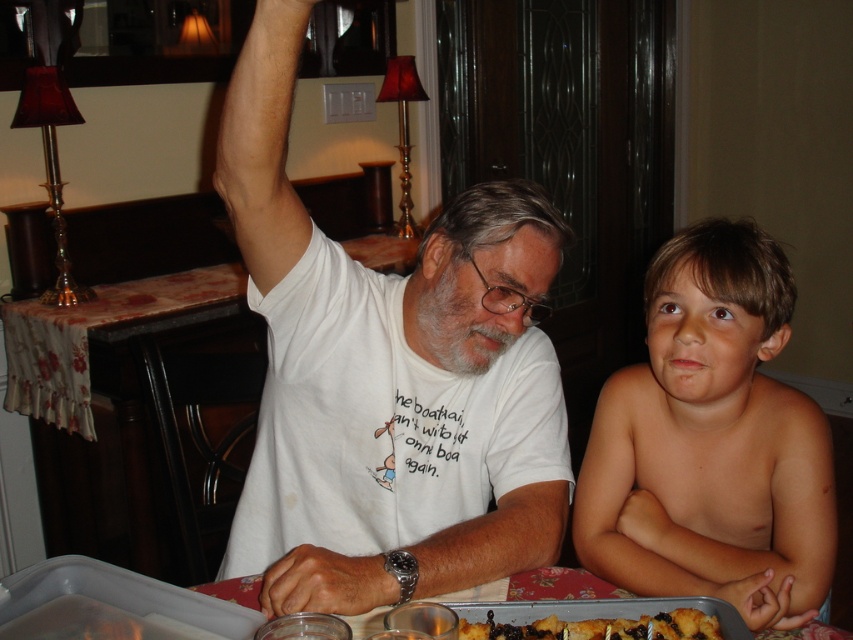
Looking at this image, does white t-shirt at center have a lesser height compared to smooth skin boy at right?

Incorrect, white t-shirt at center's height does not fall short of smooth skin boy at right's.

Who is lower down, white t-shirt at center or smooth skin boy at right?

smooth skin boy at right is lower down.

Who is more distant from viewer, (x=276, y=557) or (x=589, y=512)?

The point (x=276, y=557) is behind.

This screenshot has height=640, width=853. I want to click on white t-shirt at center, so click(387, 378).

Can you confirm if white t-shirt at center is positioned above golden brown cake at lower center?

Yes.

You are a GUI agent. You are given a task and a screenshot of the screen. Output one action in this format:
    pyautogui.click(x=<x>, y=<y>)
    Task: Click on the white t-shirt at center
    The width and height of the screenshot is (853, 640).
    Given the screenshot: What is the action you would take?
    pyautogui.click(x=387, y=378)

Is point (521, 372) positioned behind point (590, 625)?

Yes, point (521, 372) is behind point (590, 625).

Where is `white t-shirt at center`? The width and height of the screenshot is (853, 640). white t-shirt at center is located at coordinates (387, 378).

Between point (595, 464) and point (474, 627), which one is positioned in front?

Positioned in front is point (474, 627).

Is point (596, 397) in front of point (698, 634)?

No, it is behind (698, 634).

Locate an element on the screen. The width and height of the screenshot is (853, 640). smooth skin boy at right is located at coordinates (711, 442).